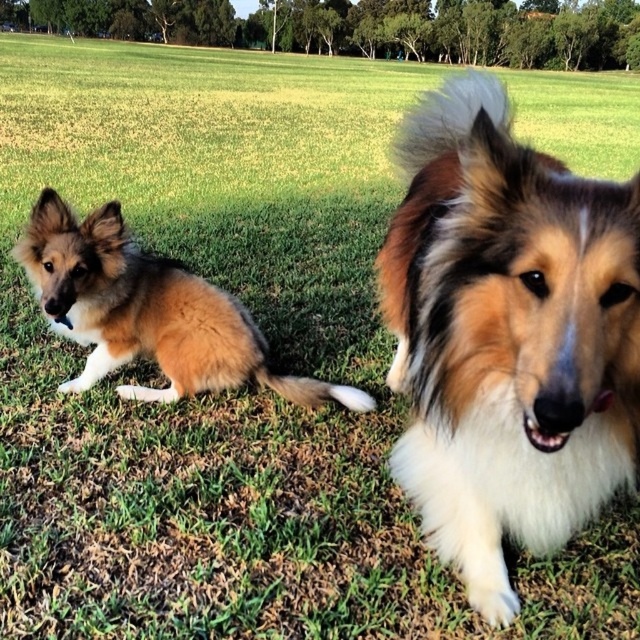
Between fluffy brown dog at center and brown fluffy dog at left, which one has less height?

Standing shorter between the two is brown fluffy dog at left.

Is fluffy brown dog at center to the right of brown fluffy dog at left from the viewer's perspective?

Indeed, fluffy brown dog at center is positioned on the right side of brown fluffy dog at left.

At what (x,y) coordinates should I click in order to perform the action: click on fluffy brown dog at center. Please return your answer as a coordinate pair (x, y). The width and height of the screenshot is (640, 640). Looking at the image, I should click on (508, 337).